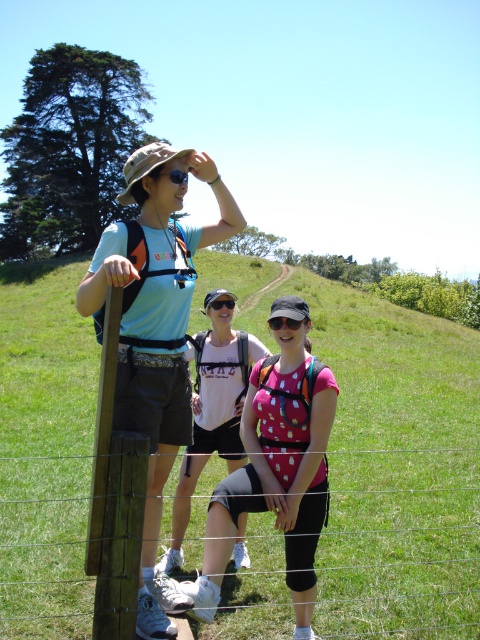
Which is behind, point (421, 637) or point (271, 378)?

The point (421, 637) is behind.

Is point (347, 484) less distant than point (206, 540)?

No, (347, 484) is behind (206, 540).

Who is more forward, (x=346, y=506) or (x=202, y=577)?

Point (x=202, y=577) is more forward.

Locate an element on the screen. Image resolution: width=480 pixels, height=640 pixels. wire mesh at lower center is located at coordinates (399, 544).

Who is positioned more to the left, matte blue shirt at center or transparent polka dot visor at center?

Positioned to the left is matte blue shirt at center.

Does matte blue shirt at center have a lesser width compared to transparent polka dot visor at center?

Incorrect, matte blue shirt at center's width is not less than transparent polka dot visor at center's.

The width and height of the screenshot is (480, 640). Find the location of `matte blue shirt at center`. matte blue shirt at center is located at coordinates (155, 332).

Which is in front, point (267, 611) or point (158, 348)?

Point (158, 348) is in front.

Does wire mesh at lower center have a smaller size compared to matte blue shirt at center?

Yes.

Between point (432, 515) and point (139, 600), which one is positioned behind?

The point (432, 515) is more distant.

This screenshot has height=640, width=480. I want to click on wire mesh at lower center, so click(x=399, y=544).